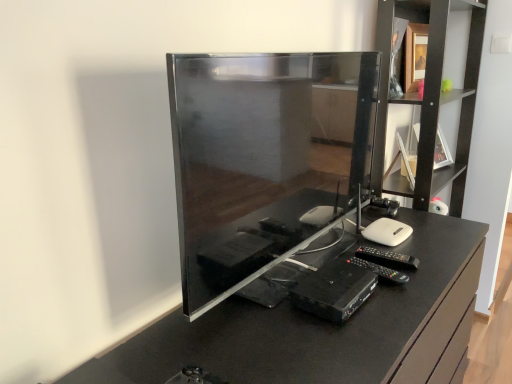
Question: From a real-world perspective, is black wood shelf at upper right above or below glossy black tv at center?

Choices:
 (A) below
 (B) above

Answer: (B)

Question: Considering the positions of black wood shelf at upper right and glossy black tv at center in the image, is black wood shelf at upper right wider or thinner than glossy black tv at center?

Choices:
 (A) thin
 (B) wide

Answer: (A)

Question: Considering the real-world distances, which object is closest to the black wood shelf at upper right?

Choices:
 (A) black plastic dvd player at center
 (B) glossy black tv at center
 (C) matte black desktop computer at center

Answer: (B)

Question: Which object is the closest to the black wood shelf at upper right?

Choices:
 (A) glossy black tv at center
 (B) matte black desktop computer at center
 (C) black plastic dvd player at center

Answer: (A)